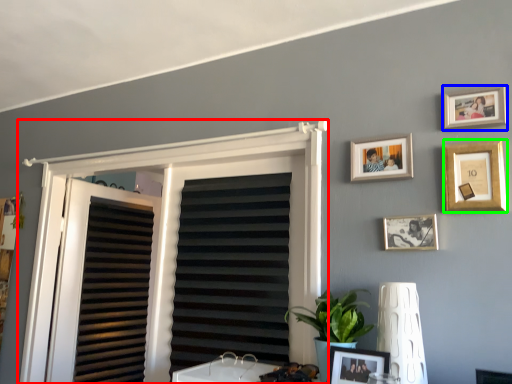
Question: Estimate the real-world distances between objects in this image. Which object is closer to window frame (highlighted by a red box), picture frame (highlighted by a blue box) or picture frame (highlighted by a green box)?

Choices:
 (A) picture frame
 (B) picture frame

Answer: (B)